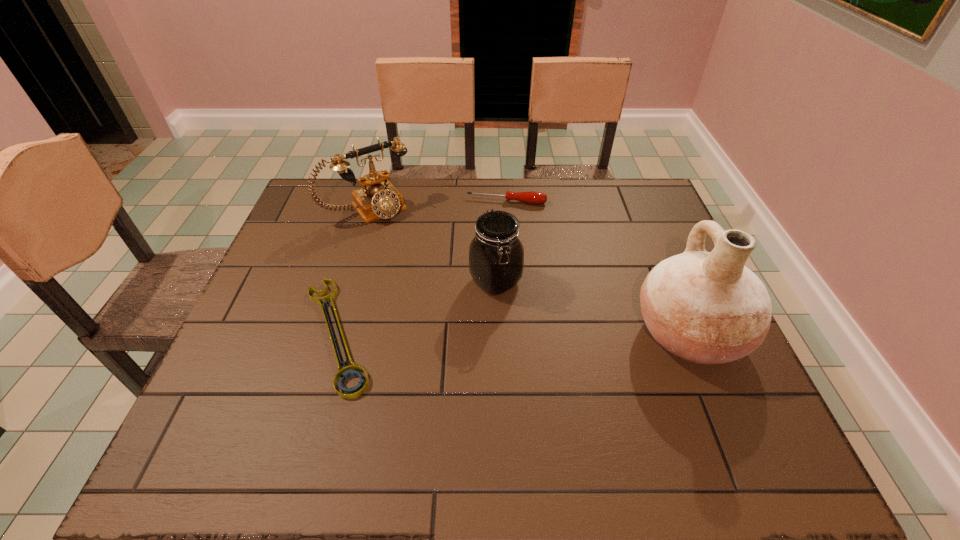
This screenshot has height=540, width=960. In order to click on free spot at the near left corner of the desktop in this screenshot , I will do `click(228, 416)`.

The image size is (960, 540). I want to click on free space at the far right corner of the desktop, so click(x=634, y=187).

The image size is (960, 540). I want to click on free spot between the shortest object and the fourth tallest object, so click(421, 268).

Where is `unoccupied area between the second shortest object and the pottery`? unoccupied area between the second shortest object and the pottery is located at coordinates pyautogui.click(x=597, y=268).

The height and width of the screenshot is (540, 960). Find the location of `empty space between the tallest object and the jar`. empty space between the tallest object and the jar is located at coordinates (591, 308).

This screenshot has height=540, width=960. Identify the location of free area in between the screwdriver and the pottery. (597, 268).

This screenshot has height=540, width=960. In order to click on free space between the tallest object and the telephone in this screenshot , I will do `click(528, 271)`.

This screenshot has width=960, height=540. What are the coordinates of `vacant region between the tallest object and the shortest object` in the screenshot? It's located at (513, 334).

The height and width of the screenshot is (540, 960). I want to click on unoccupied area between the second shortest object and the telephone, so click(438, 205).

The image size is (960, 540). Find the location of `free spot between the screwdriver and the wrench`. free spot between the screwdriver and the wrench is located at coordinates (421, 268).